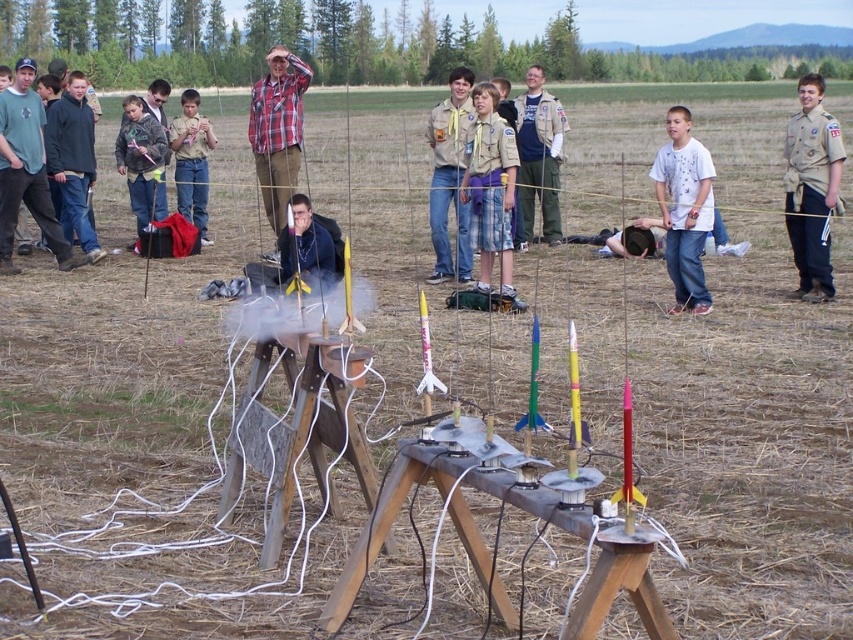
Question: Can you confirm if khaki uniform at center is bigger than matte khaki pants at center?

Choices:
 (A) no
 (B) yes

Answer: (A)

Question: Where is white cotton shirt at center located in relation to plaid flannel shirt at center in the image?

Choices:
 (A) left
 (B) right

Answer: (B)

Question: Estimate the real-world distances between objects in this image. Which object is closer to the brown uniform at center?

Choices:
 (A) khaki uniform at center
 (B) denim shorts at center

Answer: (B)

Question: Which point appears farthest from the camera in this image?

Choices:
 (A) (271, 122)
 (B) (79, 166)
 (C) (793, 172)
 (D) (177, 182)

Answer: (D)

Question: Which of these objects is positioned closest to the dark blue fleece jacket at left?

Choices:
 (A) white cotton shirt at center
 (B) brushed metal jacket at left

Answer: (B)

Question: In this image, where is white cotton shirt at center located relative to khaki pants at center?

Choices:
 (A) above
 (B) below

Answer: (B)